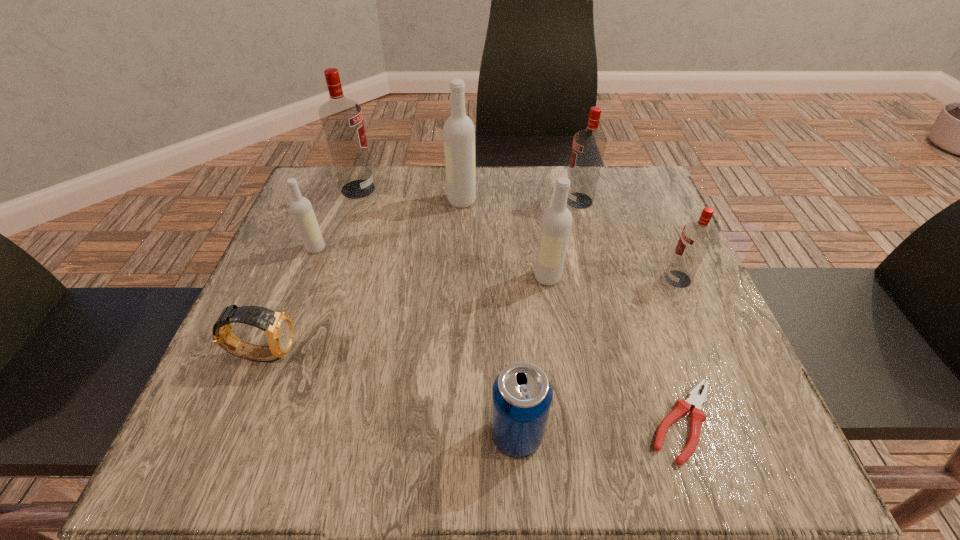
Where is `vacant area at the far right corner`? This screenshot has height=540, width=960. vacant area at the far right corner is located at coordinates (611, 214).

Where is `vacant position at the near right corner of the desktop`? The width and height of the screenshot is (960, 540). vacant position at the near right corner of the desktop is located at coordinates (759, 418).

Locate an element on the screen. This screenshot has height=540, width=960. vacant area that lies between the pliers and the blue pop soda is located at coordinates (600, 428).

Locate an element on the screen. vacant point located between the biggest red vodka and the shortest object is located at coordinates (520, 305).

Where is `empty space between the second vodka from right to left and the third nearest vodka`? The image size is (960, 540). empty space between the second vodka from right to left and the third nearest vodka is located at coordinates (447, 225).

Where is `free space between the second biggest red vodka and the pop soda`? free space between the second biggest red vodka and the pop soda is located at coordinates click(548, 318).

This screenshot has width=960, height=540. Find the location of `empty space that is in between the rightmost red vodka and the third vodka from right to left`. empty space that is in between the rightmost red vodka and the third vodka from right to left is located at coordinates (612, 278).

You are a GUI agent. You are given a task and a screenshot of the screen. Output one action in this format:
    pyautogui.click(x=<x>, y=<y>)
    Task: Click on the vacant area between the nearest red vodka and the smallest white vodka
    The height and width of the screenshot is (540, 960).
    Given the screenshot: What is the action you would take?
    pyautogui.click(x=496, y=264)

Image resolution: width=960 pixels, height=540 pixels. I want to click on free spot between the fourth vodka from left to right and the leftmost red vodka, so click(453, 233).

Find the location of a particular element. The height and width of the screenshot is (540, 960). vacant space in between the second white vodka from left to right and the gold watch is located at coordinates (363, 277).